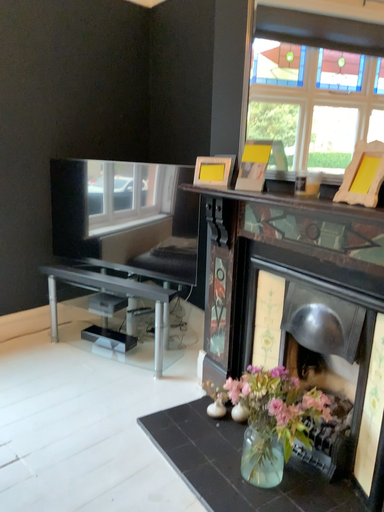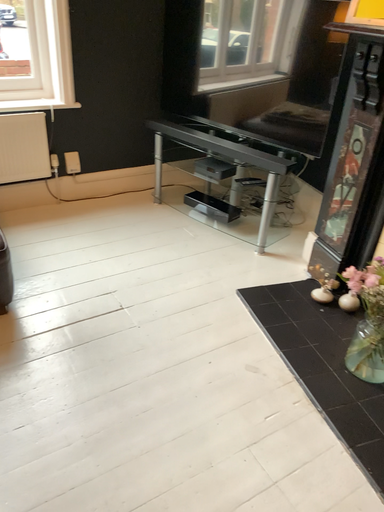
Question: How did the camera likely rotate when shooting the video?

Choices:
 (A) rotated upward
 (B) rotated downward

Answer: (B)